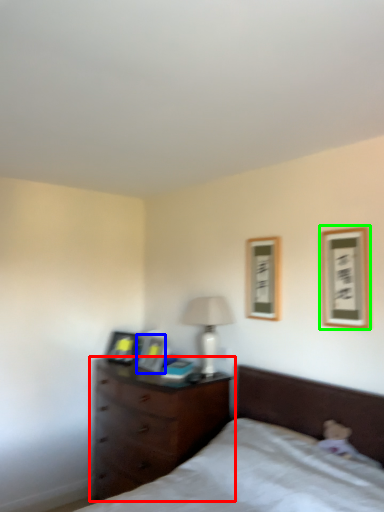
Question: Which object is positioned closest to chest of drawers (highlighted by a red box)? Select from picture frame (highlighted by a blue box) and picture frame (highlighted by a green box).

Choices:
 (A) picture frame
 (B) picture frame

Answer: (A)